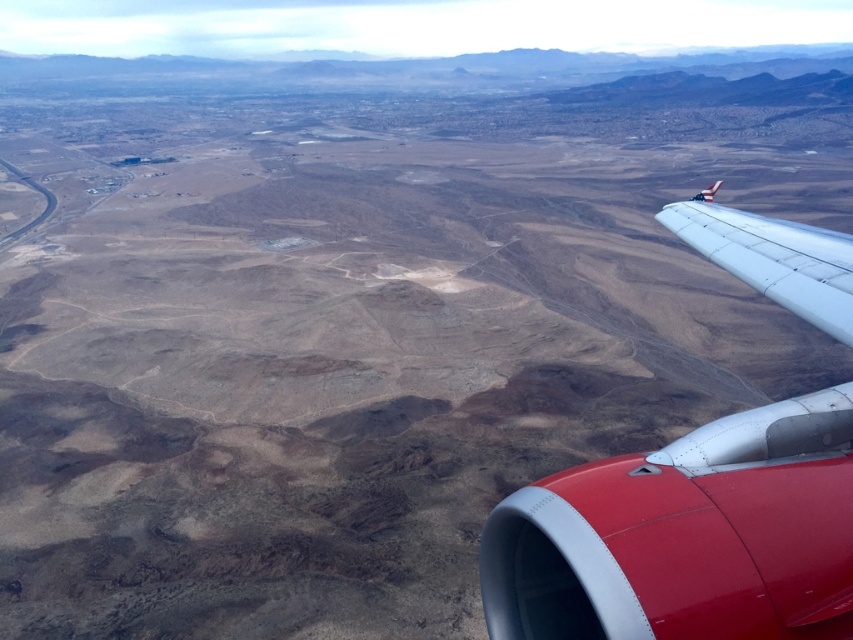
You are a pilot observing the wings of the plane from the cockpit. Which wing, the metallic silver wing at upper right or the white matte wing at right, is closer to the left side of the aircraft?

The metallic silver wing at upper right is positioned on the left side of the white matte wing at right, so it is closer to the left side of the aircraft.

You are a pilot looking at the desert landscape through the airplane window. You notice two points marked on your screen at coordinates point (699,451) and point (747,260). Based on the view from the window, which point is closer to the airplane?

Point (699,451) is in front of point (747,260), so the point closer to the airplane is point (699,451).

You are a passenger on the airplane and want to know which wing is closer to you. Based on the view from the window, which wing is closer between the metallic silver wing at upper right and the white matte wing at right?

The metallic silver wing at upper right is closer to you because it is positioned in front of the white matte wing at right, making it appear nearer in the view from the airplane window.